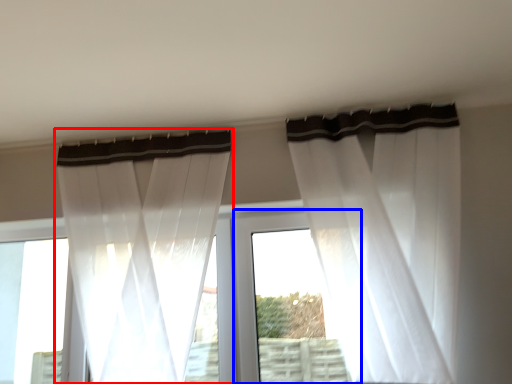
Question: Which object is further to the camera taking this photo, curtain (highlighted by a red box) or window frame (highlighted by a blue box)?

Choices:
 (A) curtain
 (B) window frame

Answer: (B)